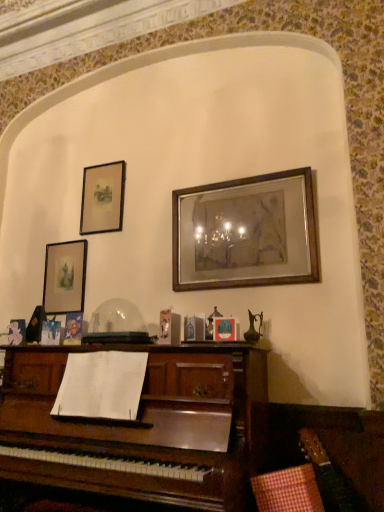
What are the coordinates of `blank space situated above wooden picture frame at center, which ranks as the first picture frame in right-to-left order (from a real-world perspective)` in the screenshot? It's located at (246, 173).